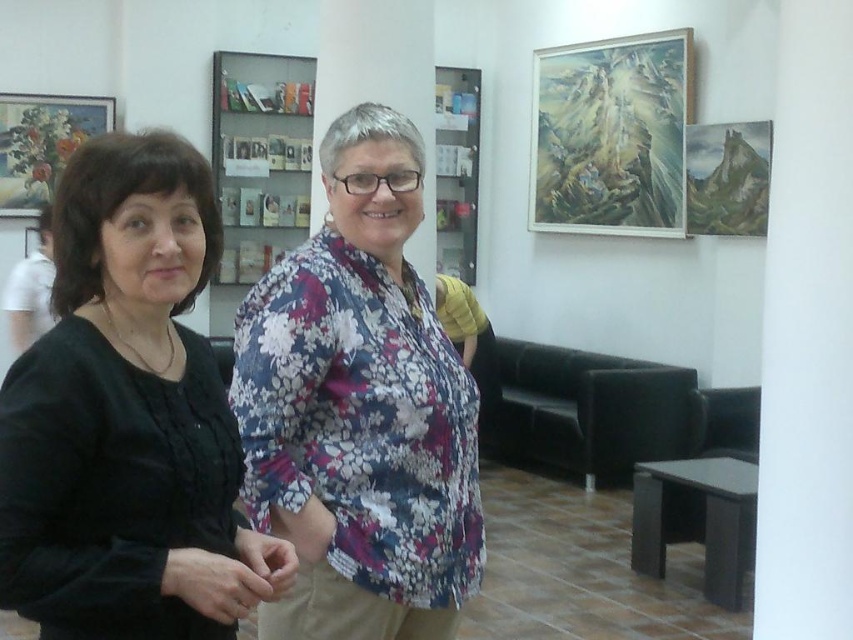
What are the coordinates of the black matte shirt at left?

The black matte shirt at left is located at coordinates (x=126, y=417).

You are an art curator planning to install a new sculpture between the oil painting at upper right and the white shirt at left. Given that the sculpture requires a minimum width of 30 cm, can you determine if there is enough space between them based on their widths?

The oil painting at upper right is thinner than the white shirt at left. However, without specific measurements, it is impossible to determine if the space between them meets the sculpture requirement. Additional information is needed.